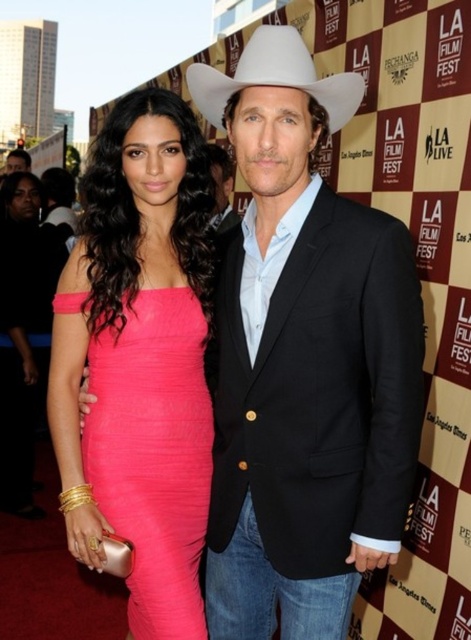
Question: Is pink satin clutch at lower left positioned in front of white matte fedora at upper center?

Choices:
 (A) yes
 (B) no

Answer: (B)

Question: Is pink satin clutch at lower left above white matte fedora at upper center?

Choices:
 (A) yes
 (B) no

Answer: (B)

Question: Which point is farther to the camera?

Choices:
 (A) pink satin clutch at lower left
 (B) pink ribbed dress at center

Answer: (A)

Question: Among these points, which one is nearest to the camera?

Choices:
 (A) 32,353
 (B) 261,72
 (C) 193,532

Answer: (B)

Question: Which of these objects is positioned closest to the white matte fedora at upper center?

Choices:
 (A) pink satin clutch at lower left
 (B) pink ribbed dress at center

Answer: (B)

Question: Is pink ribbed dress at center in front of pink satin clutch at lower left?

Choices:
 (A) yes
 (B) no

Answer: (A)